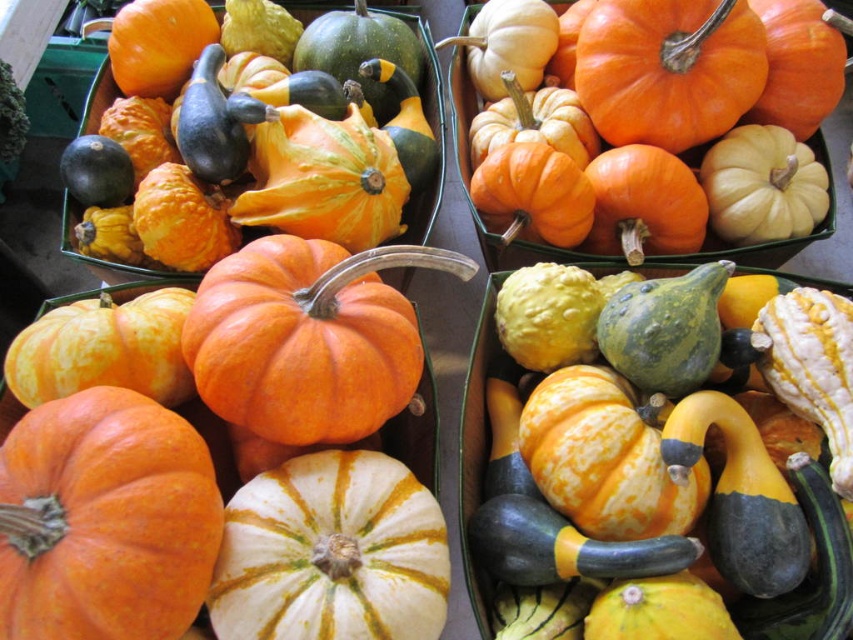
Question: Is orange matte pumpkin at lower left further to the viewer compared to orange matte pumpkin at upper right?

Choices:
 (A) yes
 (B) no

Answer: (B)

Question: Does orange matte pumpkin at lower left appear on the right side of orange matte pumpkin at upper left?

Choices:
 (A) yes
 (B) no

Answer: (A)

Question: Which point is closer to the camera?

Choices:
 (A) (345, 552)
 (B) (468, 22)
 (C) (115, 448)

Answer: (C)

Question: Which of these objects is positioned closest to the orange matte pumpkin at upper right?

Choices:
 (A) orange matte pumpkin at upper left
 (B) white matte pumpkin at center
 (C) orange matte pumpkin at lower left

Answer: (A)

Question: Among these objects, which one is nearest to the camera?

Choices:
 (A) orange matte pumpkin at lower left
 (B) orange matte pumpkin at upper left
 (C) orange matte pumpkin at upper right

Answer: (A)

Question: Can you confirm if orange matte pumpkin at upper left is positioned to the right of orange matte pumpkin at upper right?

Choices:
 (A) yes
 (B) no

Answer: (B)